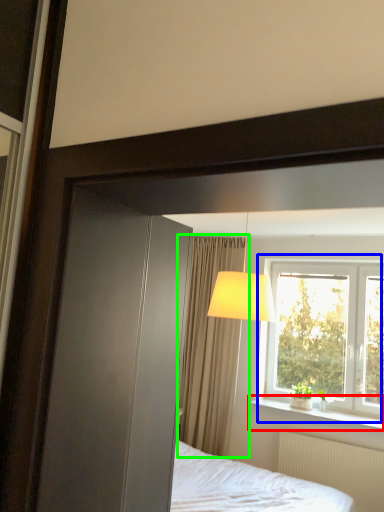
Question: Based on their relative distances, which object is farther from window sill (highlighted by a red box)? Choose from window (highlighted by a blue box) and curtain (highlighted by a green box).

Choices:
 (A) window
 (B) curtain

Answer: (B)